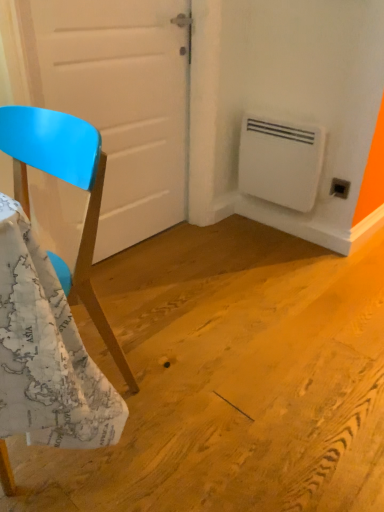
At what (x,y) coordinates should I click in order to perform the action: click on vacant space to the right of matte blue chair at left. Please return your answer as a coordinate pair (x, y). Looking at the image, I should click on (182, 393).